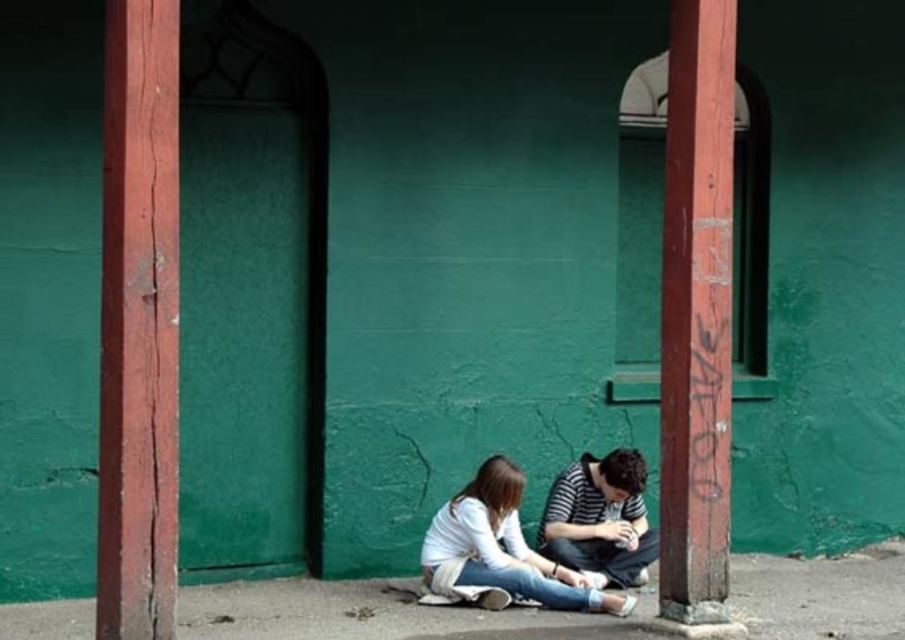
You are standing in the scene and want to move from the striped cotton shirt at lower center to the rusty wood post at right. In which direction should you move?

You should move to the right to reach the rusty wood post at right from the striped cotton shirt at lower center because the rusty wood post at right is located to the right of the striped cotton shirt at lower center.

You are standing in the scene and want to place a small potted plant between the rusty wood post at right and the striped cotton shirt at lower center. Which object should the plant be closer to?

The rusty wood post at right is closer to the viewer than the striped cotton shirt at lower center, so the plant should be placed closer to the striped cotton shirt at lower center to maintain equal distance from both objects.

You are a photographer setting up a shoot in this location. You want to ensure that the rusty wood post at right and the striped cotton shirt at lower center are both visible in the frame. Given their sizes, which object should you prioritize placing closer to the camera to maintain their visibility?

The rusty wood post at right is larger in size than the striped cotton shirt at lower center. To ensure both are visible, prioritize placing the striped cotton shirt at lower center closer to the camera since its smaller size might require closer framing to be adequately visible.